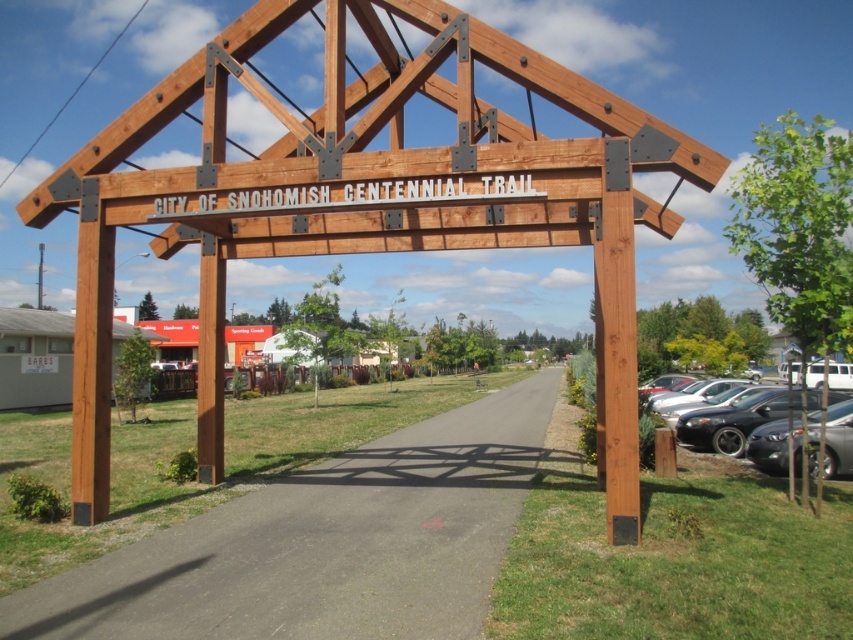
Between natural wood sign at center and asphalt path at center, which one has more height?

Standing taller between the two is natural wood sign at center.

Is natural wood sign at center above asphalt path at center?

Correct, natural wood sign at center is located above asphalt path at center.

Does point (325, 140) come closer to viewer compared to point (392, 433)?

Yes, point (325, 140) is in front of point (392, 433).

Image resolution: width=853 pixels, height=640 pixels. Find the location of `natural wood sign at center`. natural wood sign at center is located at coordinates (368, 202).

Which is more to the right, asphalt path at center or matte black car at lower right?

Positioned to the right is matte black car at lower right.

Between asphalt path at center and matte black car at lower right, which one has less height?

Standing shorter between the two is asphalt path at center.

Is point (491, 412) farther from viewer compared to point (843, 472)?

Yes, it is behind point (843, 472).

Where is `asphalt path at center`? asphalt path at center is located at coordinates (325, 541).

Can you confirm if natural wood sign at center is positioned to the right of matte black car at lower right?

Incorrect, natural wood sign at center is not on the right side of matte black car at lower right.

What do you see at coordinates (368, 202) in the screenshot? I see `natural wood sign at center` at bounding box center [368, 202].

At what (x,y) coordinates should I click in order to perform the action: click on natural wood sign at center. Please return your answer as a coordinate pair (x, y). This screenshot has height=640, width=853. Looking at the image, I should click on (368, 202).